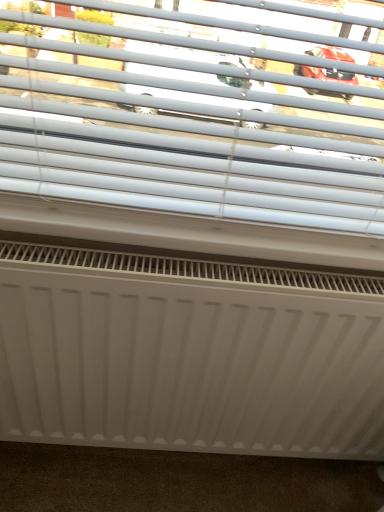
The height and width of the screenshot is (512, 384). Describe the element at coordinates (189, 354) in the screenshot. I see `white matte radiator at lower center` at that location.

Image resolution: width=384 pixels, height=512 pixels. I want to click on white matte radiator at lower center, so pyautogui.click(x=189, y=354).

In order to face white matte radiator at lower center, should I rotate leftwards or rightwards?

Rotate your view right by about 4.241°.

Where is `white matte radiator at lower center`? white matte radiator at lower center is located at coordinates (x=189, y=354).